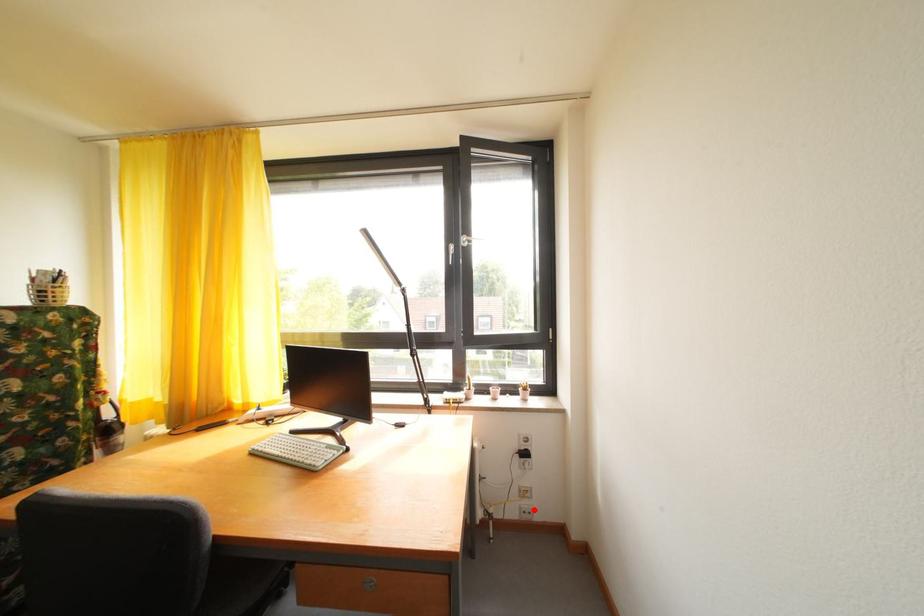
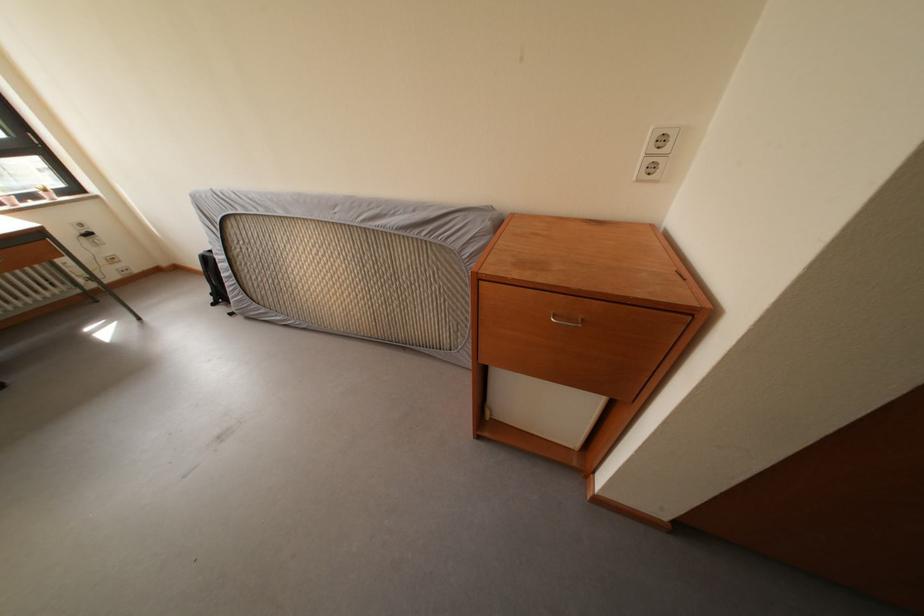
Find the pixel in the second image that matches the highlighted location in the first image.

(128, 273)